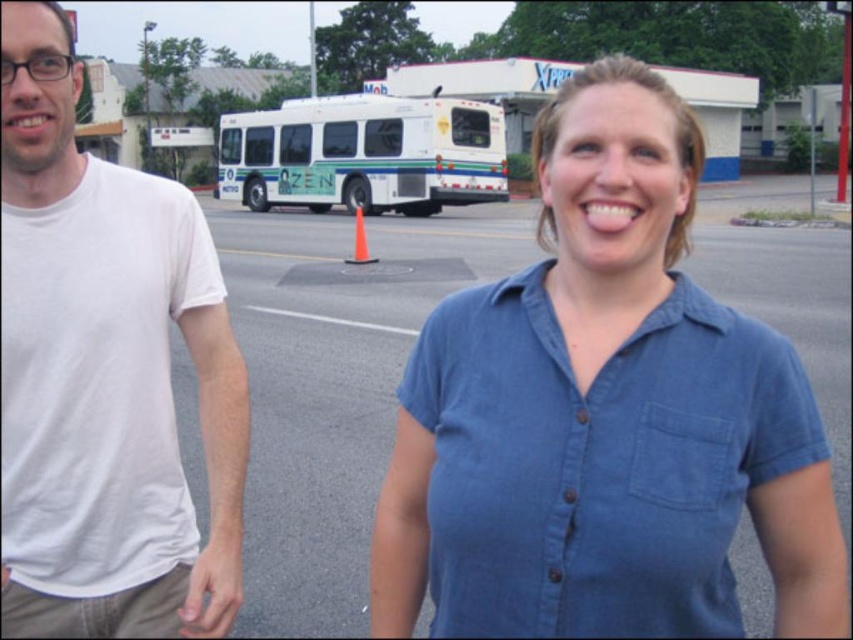
Question: Which object is positioned closest to the white matte bus at center?

Choices:
 (A) white cotton t-shirt at left
 (B) denim shirt at center

Answer: (A)

Question: Which point is farther from the camera taking this photo?

Choices:
 (A) (254, 112)
 (B) (45, 458)
 (C) (692, 429)

Answer: (A)

Question: Is denim shirt at center above white cotton t-shirt at left?

Choices:
 (A) no
 (B) yes

Answer: (B)

Question: Does denim shirt at center appear over white cotton t-shirt at left?

Choices:
 (A) yes
 (B) no

Answer: (A)

Question: Is denim shirt at center further to the viewer compared to white cotton t-shirt at left?

Choices:
 (A) yes
 (B) no

Answer: (B)

Question: Which object appears farthest from the camera in this image?

Choices:
 (A) denim shirt at center
 (B) white matte bus at center
 (C) white cotton t-shirt at left

Answer: (B)